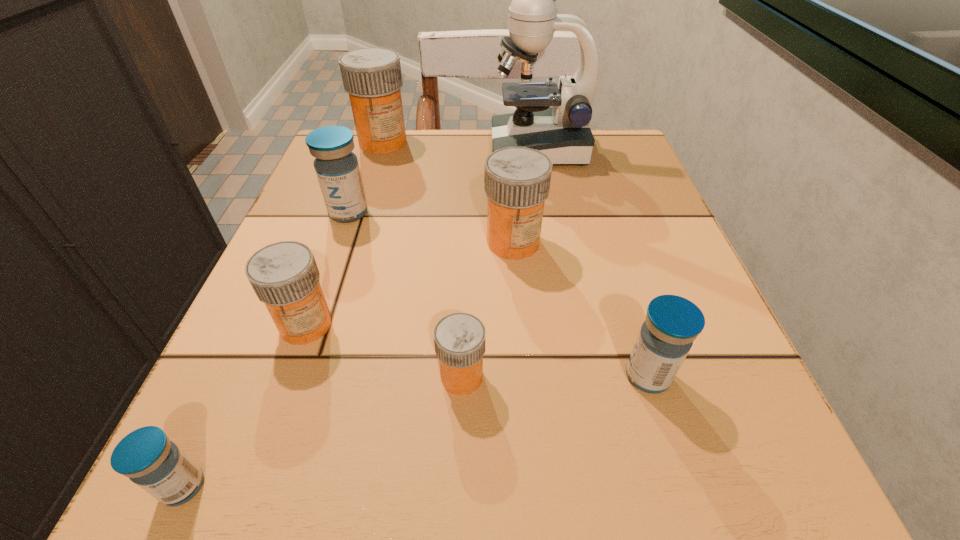
At what (x,y) coordinates should I click in order to perform the action: click on free spot located 0.270m on the label side of the third nearest orange medicine. Please return your answer as a coordinate pair (x, y). This screenshot has width=960, height=540. Looking at the image, I should click on (528, 418).

At what (x,y) coordinates should I click in order to perform the action: click on free region located on the label side of the fourth nearest object. Please return your answer as a coordinate pair (x, y). Image resolution: width=960 pixels, height=540 pixels. Looking at the image, I should click on (270, 425).

Locate an element on the screen. This screenshot has height=540, width=960. vacant space located 0.250m on the left of the second farthest blue medicine is located at coordinates (426, 376).

The height and width of the screenshot is (540, 960). What are the coordinates of `vacant position located on the label side of the second orange medicine from right to left` in the screenshot? It's located at (722, 377).

Where is `vacant area situated 0.220m on the back of the nearest object`? This screenshot has height=540, width=960. vacant area situated 0.220m on the back of the nearest object is located at coordinates (263, 312).

At what (x,y) coordinates should I click in order to perform the action: click on microscope that is at the far edge. Please return your answer as a coordinate pair (x, y). The image size is (960, 540). Looking at the image, I should click on (562, 132).

Where is `medicine located in the far edge section of the desktop`? medicine located in the far edge section of the desktop is located at coordinates (372, 76).

Identify the location of object that is at the near edge. (157, 465).

I want to click on microscope present at the right edge, so click(562, 132).

The height and width of the screenshot is (540, 960). In order to click on medicine positioned at the right edge in this screenshot , I will do `click(672, 323)`.